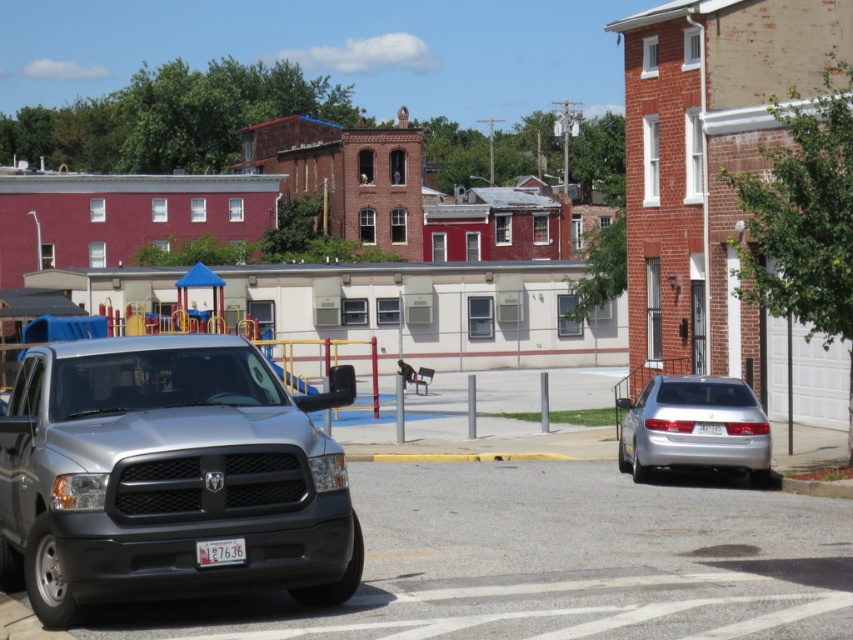
You are a delivery person who needs to park your 5.5 meter long truck between the matte gray truck at lower left and the silver metallic sedan at right. Can you fit your truck in the space between them without moving either vehicle?

The distance between the matte gray truck at lower left and the silver metallic sedan at right is 11.02 meters. Since your truck is 5.5 meters long, it can fit in the space as the available space is twice the length of your truck.

You are standing at the silver pickup truck parked on the left side of the street. You notice two points marked in the scene. Which point, point [257,385] or point [695,458], is closer to you?

Point [257,385] is closer to you because it is in front of point [695,458].

Based on the photo, you are a delivery driver who needs to park your truck, which is 6 feet tall, in this residential street scene. The parking spot is between the matte gray truck at lower left and the silver metallic sedan at right. Can your truck fit without hitting the sedan?

The matte gray truck at lower left is taller than the silver metallic sedan at right. Since your truck is 6 feet tall, you need to ensure there is enough vertical clearance. However, the description only mentions the height comparison between the two vehicles, not the available space between them. Without knowing the distance between the two vehicles, it is impossible to determine if your truck can fit without hitting the sedan.